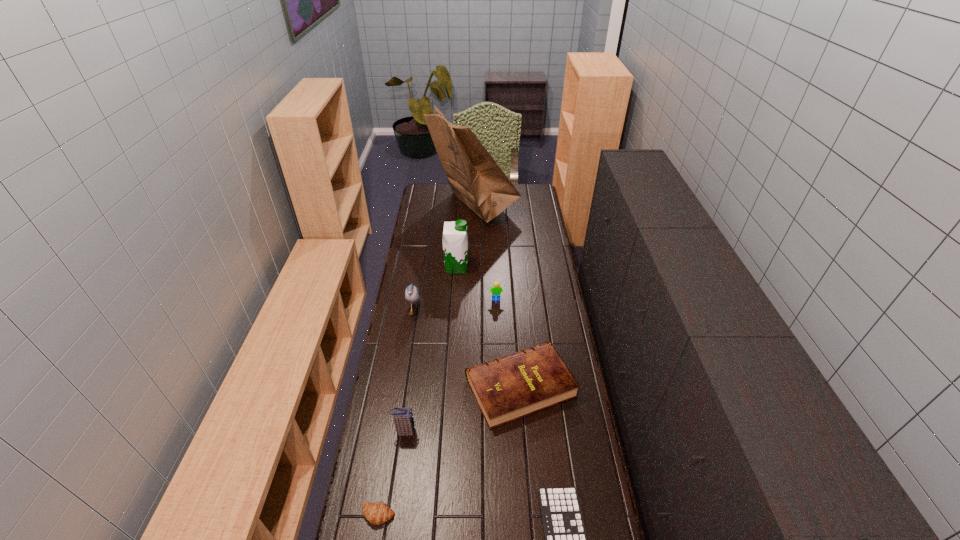
The height and width of the screenshot is (540, 960). In order to click on the farthest object in this screenshot , I will do `click(475, 178)`.

Identify the location of grocery bag. (475, 178).

What are the coordinates of `the seventh nearest object` in the screenshot? It's located at (455, 237).

Locate an element on the screen. soya milk is located at coordinates (455, 237).

What are the coordinates of `bird` in the screenshot? It's located at (412, 295).

Identify the location of clutch bag. (403, 418).

Identify the location of the fifth tallest object. The width and height of the screenshot is (960, 540). (496, 290).

Where is `hardback book`? The image size is (960, 540). hardback book is located at coordinates (508, 388).

Identify the location of the seventh tallest object. (377, 513).

This screenshot has height=540, width=960. In order to click on blank space located on the front of the tallest object in this screenshot , I will do `click(472, 267)`.